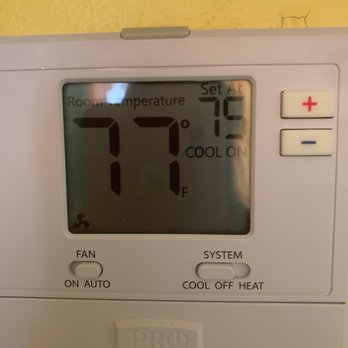
At what (x,y) coordinates should I click in order to perform the action: click on walls. Please return your answer as a coordinate pair (x, y). Looking at the image, I should click on (251, 26), (110, 13).